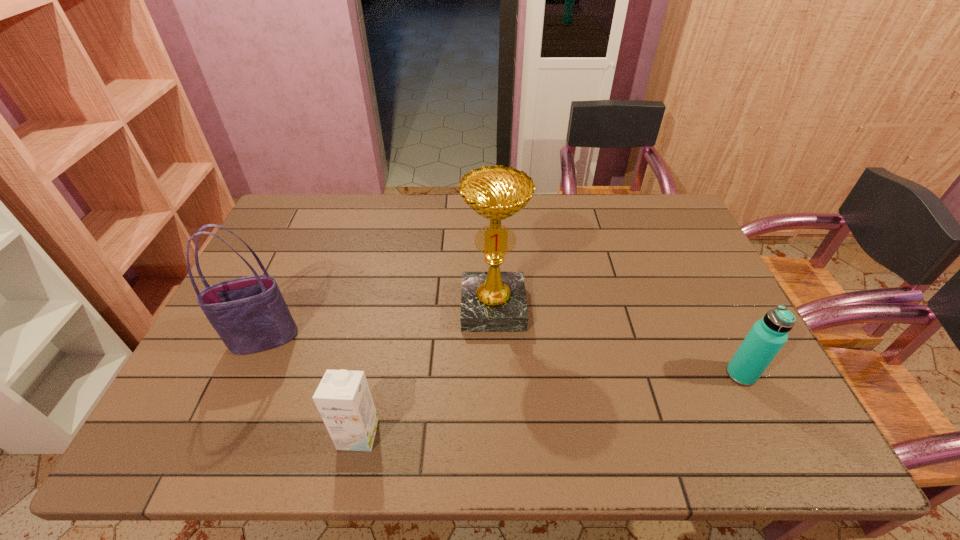
This screenshot has width=960, height=540. In order to click on vacant area between the tote bag and the water bottle in this screenshot , I will do `click(502, 357)`.

Locate an element on the screen. The image size is (960, 540). free space between the leftmost object and the nearest object is located at coordinates (311, 387).

Find the location of a particular element. blank region between the third object from right to left and the water bottle is located at coordinates (550, 404).

This screenshot has width=960, height=540. Find the location of `vacant space that's between the carton and the leftmost object`. vacant space that's between the carton and the leftmost object is located at coordinates (311, 387).

At what (x,y) coordinates should I click in order to perform the action: click on empty space that is in between the third object from right to left and the tote bag. Please return your answer as a coordinate pair (x, y). Image resolution: width=960 pixels, height=540 pixels. Looking at the image, I should click on (311, 387).

At what (x,y) coordinates should I click in order to perform the action: click on free point between the second object from right to left and the second nearest object. Please return your answer as a coordinate pair (x, y). The height and width of the screenshot is (540, 960). Looking at the image, I should click on (617, 341).

The image size is (960, 540). In order to click on free spot between the nearest object and the award in this screenshot , I will do `click(425, 371)`.

At what (x,y) coordinates should I click in order to perform the action: click on object that stands as the second closest to the tote bag. Please return your answer as a coordinate pair (x, y). The image size is (960, 540). Looking at the image, I should click on (493, 301).

Where is `object that is the nearest to the rightmost object`? The height and width of the screenshot is (540, 960). object that is the nearest to the rightmost object is located at coordinates (493, 301).

Where is `vacant area in the image that satisfies the following two spatial constraints: 1. on the front-facing side of the award; 2. on the right side of the water bottle`? This screenshot has height=540, width=960. vacant area in the image that satisfies the following two spatial constraints: 1. on the front-facing side of the award; 2. on the right side of the water bottle is located at coordinates (495, 375).